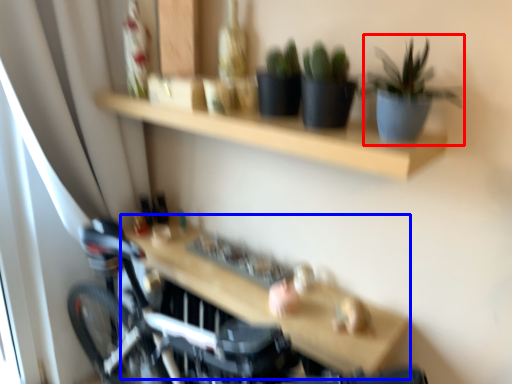
Question: Which of the following is the farthest to the observer, houseplant (highlighted by a red box) or table (highlighted by a blue box)?

Choices:
 (A) houseplant
 (B) table

Answer: (B)